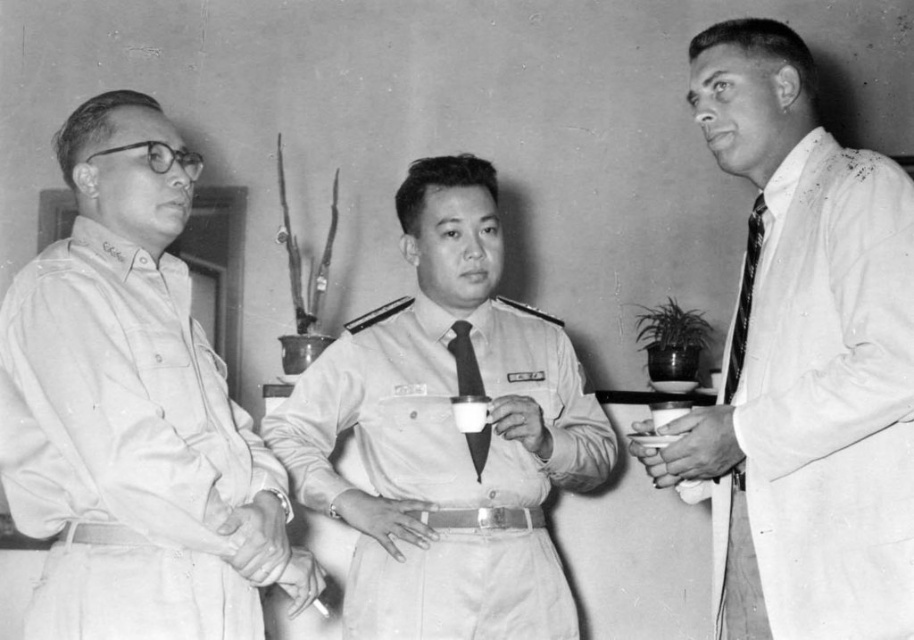
You are an interior designer planning to hang a 1.2 meter tall painting above a sofa. The sofa has a white smooth coat at right and a black silk tie at center nearby. Which object should you use as a reference to ensure the painting is centered and aligned properly?

The white smooth coat at right has a greater height compared to the black silk tie at center. Since the painting is taller, aligning it with the taller white smooth coat at right would provide better visual balance and ensure proper centering.

You are standing in the room where the three individuals are conversing. You need to deliver a message to the person wearing the matte khaki shirt at left. Based on their position, which direction should you approach from to ensure you are facing them directly?

To face the matte khaki shirt at left directly, approach from the left side since they are positioned at the leftmost part of the scene.

In the scene described, there are two uniforms visible. The white smooth coat at right and the light khaki fabric uniform at center. Which of these two uniforms is positioned further to the right side of the image?

The white smooth coat at right is positioned further to the right side of the image compared to the light khaki fabric uniform at center.